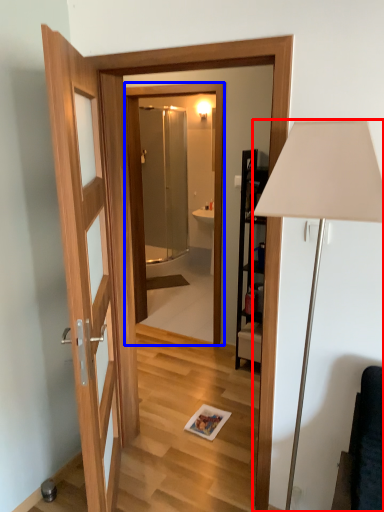
Question: Among these objects, which one is farthest to the camera, lamp (highlighted by a red box) or mirror (highlighted by a blue box)?

Choices:
 (A) lamp
 (B) mirror

Answer: (B)